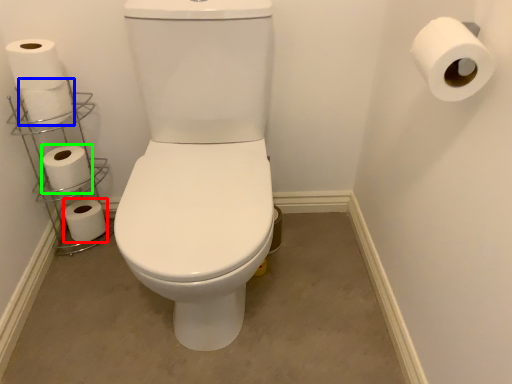
Question: Estimate the real-world distances between objects in this image. Which object is farther from toilet paper (highlighted by a red box), toilet paper (highlighted by a blue box) or toilet paper (highlighted by a green box)?

Choices:
 (A) toilet paper
 (B) toilet paper

Answer: (A)